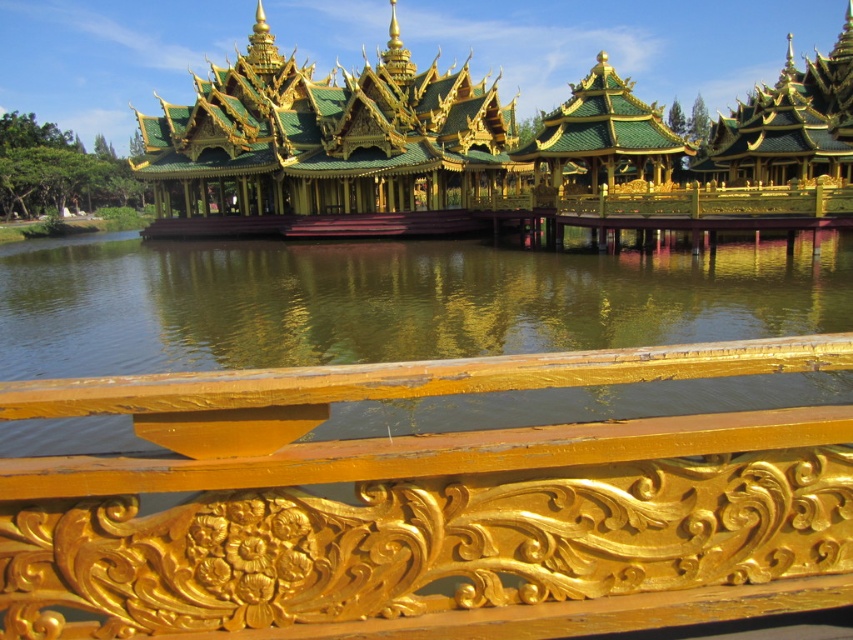
You are standing at the point marked by the coordinates point [428,506] in the image. What object are you directly facing?

The point [428,506] marks the gold carved wood rail at center, so you are directly facing the gold carved wood rail at center.

You are a tourist standing on the walkway leading to the golden structure. You notice the gold carved wood rail at center and the green reflective water at center. Which object is positioned lower from the ground?

The gold carved wood rail at center is located below the green reflective water at center, so it is positioned lower from the ground.